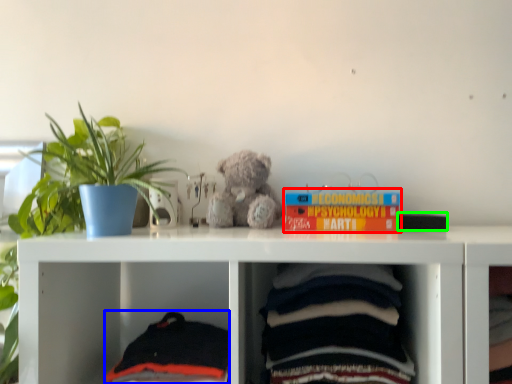
Question: Which object is the closest to the book (highlighted by a red box)? Choose among these: baby clothe (highlighted by a blue box) or book (highlighted by a green box).

Choices:
 (A) baby clothe
 (B) book

Answer: (B)